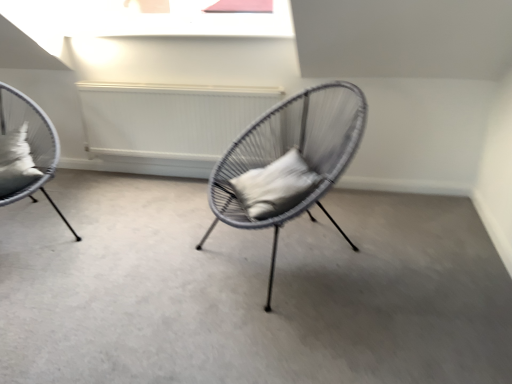
Question: In terms of width, does woven wire chair at center, which is the 2th chair in left-to-right order, look wider or thinner when compared to white soft pillow at left, which ranks as the first pillow in left-to-right order?

Choices:
 (A) wide
 (B) thin

Answer: (A)

Question: In the image, is woven wire chair at center, which is the 2th chair in left-to-right order, on the left side or the right side of white soft pillow at left, the second pillow from the right?

Choices:
 (A) left
 (B) right

Answer: (B)

Question: Which object is the farthest from the white matte pillow at center, the 2th pillow from the left?

Choices:
 (A) matte grey wicker chair at left, the 1th chair viewed from the left
 (B) white soft pillow at left, which ranks as the first pillow in left-to-right order
 (C) woven wire chair at center, which is the 2th chair in left-to-right order
 (D) white textured radiator at center
 (E) matte gray chair at center

Answer: (B)

Question: Which object is positioned farthest from the matte grey wicker chair at left, the 1th chair viewed from the left?

Choices:
 (A) woven wire chair at center, which is the 2th chair in left-to-right order
 (B) white matte pillow at center, placed as the 1th pillow when sorted from right to left
 (C) matte gray chair at center
 (D) white textured radiator at center
 (E) white soft pillow at left, the second pillow from the right

Answer: (A)